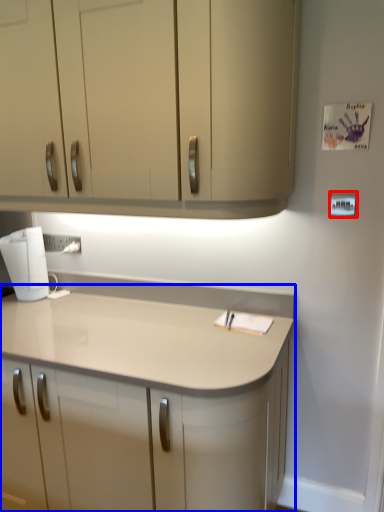
Question: Which object appears closest to the camera in this image, light switch (highlighted by a red box) or countertop (highlighted by a blue box)?

Choices:
 (A) light switch
 (B) countertop

Answer: (B)